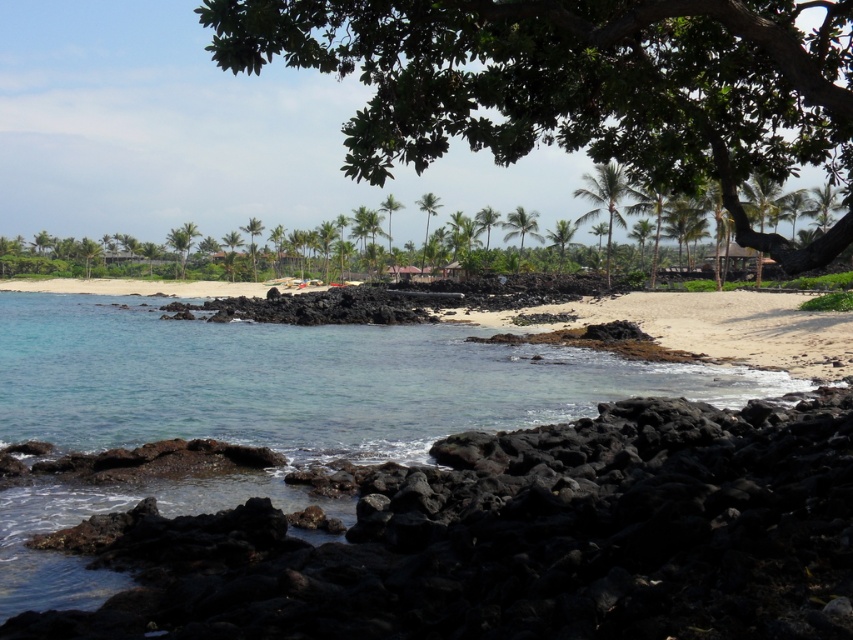
Is green leafy tree at upper center below green leafy palm tree at center?

Yes.

Does green leafy tree at upper center appear on the left side of green leafy palm tree at center?

Indeed, green leafy tree at upper center is positioned on the left side of green leafy palm tree at center.

The height and width of the screenshot is (640, 853). Describe the element at coordinates (579, 84) in the screenshot. I see `green leafy tree at upper center` at that location.

Identify the location of green leafy tree at upper center. The height and width of the screenshot is (640, 853). (579, 84).

Does black volcanic rock at lower left appear under green leafy palm tree at center?

Correct, black volcanic rock at lower left is located below green leafy palm tree at center.

Does point (102, 616) come in front of point (612, 218)?

Yes, it is.

In order to click on black volcanic rock at lower left in this screenshot , I will do `click(517, 540)`.

Which is below, white sandy beach at lower right or green leafy palm tree at center?

white sandy beach at lower right is lower down.

Is white sandy beach at lower right thinner than green leafy palm tree at center?

Incorrect, white sandy beach at lower right's width is not less than green leafy palm tree at center's.

Is point (576, 308) closer to viewer compared to point (587, 193)?

Yes.

Locate an element on the screen. This screenshot has height=640, width=853. white sandy beach at lower right is located at coordinates (732, 326).